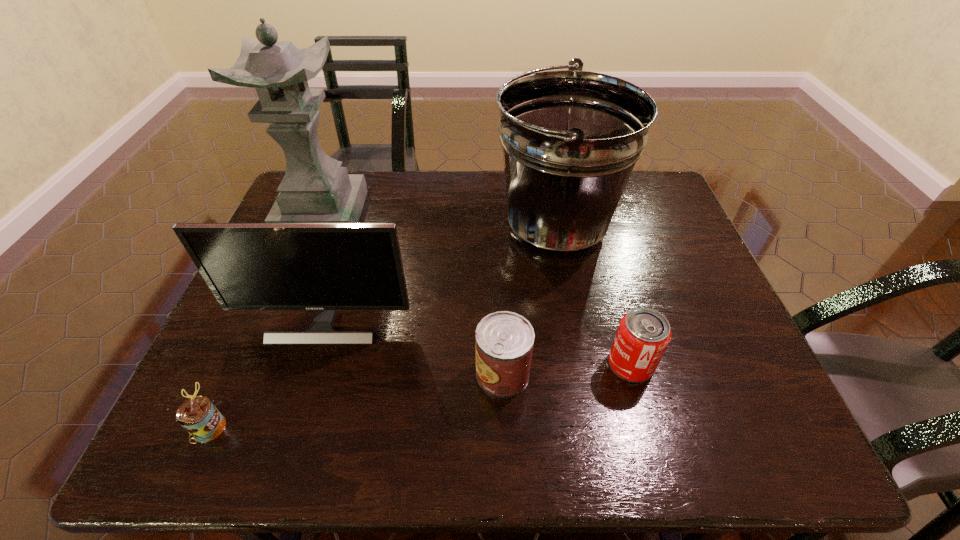
Identify the location of the tallest object. The height and width of the screenshot is (540, 960). (315, 189).

Where is `the second tallest object`? This screenshot has height=540, width=960. the second tallest object is located at coordinates (570, 138).

Where is `the third tallest object`? The width and height of the screenshot is (960, 540). the third tallest object is located at coordinates (326, 267).

Where is `the fourth nearest object`? The height and width of the screenshot is (540, 960). the fourth nearest object is located at coordinates (326, 267).

You are a GUI agent. You are given a task and a screenshot of the screen. Output one action in this format:
    pyautogui.click(x=<x>, y=<y>)
    Task: Click on the rightmost can
    This screenshot has height=540, width=960.
    Given the screenshot: What is the action you would take?
    pyautogui.click(x=643, y=335)

At what (x,y) coordinates should I click in order to perform the action: click on the second can from right to left. Please return your answer as a coordinate pair (x, y). Image resolution: width=960 pixels, height=540 pixels. Looking at the image, I should click on (504, 340).

Find the location of a particular element. The image size is (960, 540). the shortest can is located at coordinates (198, 416).

Identify the location of the nearest can. (198, 416).

Locate an element on the screen. vacant space located at the front opening of the sculpture is located at coordinates (293, 288).

Where is `blank space located on the left of the fifth shortest object`? blank space located on the left of the fifth shortest object is located at coordinates (408, 227).